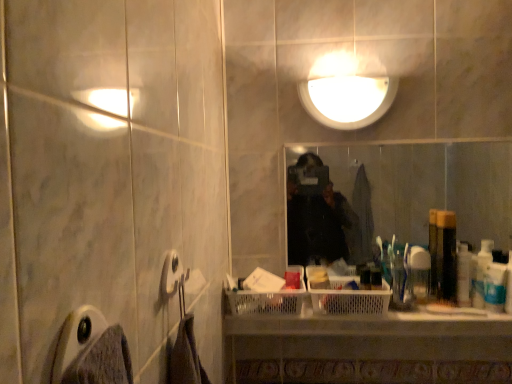
Question: Does translucent plastic bottle at right, the 2th toiletry from the left, appear on the right side of gray fabric towel bar at lower left?

Choices:
 (A) yes
 (B) no

Answer: (A)

Question: Is translucent plastic bottle at right, which appears as the 4th toiletry when viewed from the right, shorter than gray fabric towel bar at lower left?

Choices:
 (A) no
 (B) yes

Answer: (A)

Question: From the image's perspective, would you say translucent plastic bottle at right, the 2th toiletry from the left, is positioned over gray fabric towel bar at lower left?

Choices:
 (A) yes
 (B) no

Answer: (B)

Question: Is translucent plastic bottle at right, which appears as the 4th toiletry when viewed from the right, facing away from gray fabric towel bar at lower left?

Choices:
 (A) no
 (B) yes

Answer: (A)

Question: Does translucent plastic bottle at right, which appears as the 4th toiletry when viewed from the right, lie behind gray fabric towel bar at lower left?

Choices:
 (A) no
 (B) yes

Answer: (B)

Question: Is point (485, 263) closer or farther from the camera than point (424, 152)?

Choices:
 (A) farther
 (B) closer

Answer: (B)

Question: In the image, is white plastic toothbrush at right, which ranks as the 2th toiletry in right-to-left order, on the left side or the right side of clear plastic mirror at center?

Choices:
 (A) right
 (B) left

Answer: (A)

Question: Is white plastic toothbrush at right, which is counted as the 4th toiletry, starting from the left, inside the boundaries of clear plastic mirror at center, or outside?

Choices:
 (A) inside
 (B) outside

Answer: (B)

Question: Looking at their shapes, would you say white plastic toothbrush at right, which is counted as the 4th toiletry, starting from the left, is wider or thinner than clear plastic mirror at center?

Choices:
 (A) thin
 (B) wide

Answer: (B)

Question: In terms of width, does translucent plastic bottle at right, which appears as the 4th toiletry when viewed from the right, look wider or thinner when compared to gray fabric towel bar at lower left?

Choices:
 (A) wide
 (B) thin

Answer: (A)

Question: From a real-world perspective, relative to gray fabric towel bar at lower left, is translucent plastic bottle at right, the 2th toiletry from the left, vertically above or below?

Choices:
 (A) below
 (B) above

Answer: (A)

Question: Choose the correct answer: Is translucent plastic bottle at right, the 2th toiletry from the left, inside gray fabric towel bar at lower left or outside it?

Choices:
 (A) inside
 (B) outside

Answer: (B)

Question: Considering their positions, is translucent plastic bottle at right, which appears as the 4th toiletry when viewed from the right, located in front of or behind gray fabric towel bar at lower left?

Choices:
 (A) front
 (B) behind

Answer: (B)

Question: Is point (348, 117) positioned closer to the camera than point (490, 286)?

Choices:
 (A) closer
 (B) farther

Answer: (B)

Question: Is white glossy light fixture at upper center situated inside white plastic bottle at right, which is the first toiletry in right-to-left order, or outside?

Choices:
 (A) outside
 (B) inside

Answer: (A)